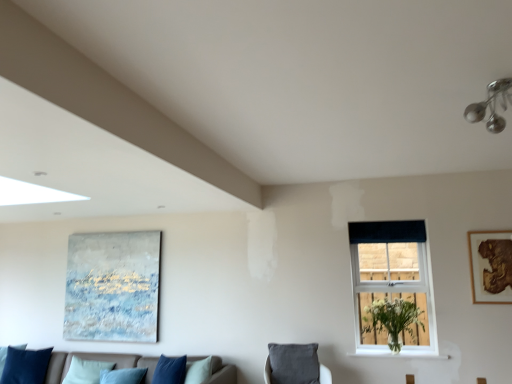
Question: Is wooden framed artwork at upper right, which appears as the first picture frame when viewed from the right, wider or thinner than dark blue fabric at upper right?

Choices:
 (A) wide
 (B) thin

Answer: (B)

Question: Is point (505, 244) positioned closer to the camera than point (364, 241)?

Choices:
 (A) farther
 (B) closer

Answer: (B)

Question: Which of these objects is positioned farthest from the dark blue fabric at upper right?

Choices:
 (A) velvet grey cushion at lower center
 (B) white painted wood at lower right
 (C) wooden framed artwork at upper right, which appears as the first picture frame when viewed from the right
 (D) velvet blue cushions at lower left
 (E) white plastic window at center

Answer: (D)

Question: Which object is positioned farthest from the wooden framed artwork at upper right, the 1th picture frame when ordered from front to back?

Choices:
 (A) white matte vase at window
 (B) velvet blue pillow at lower left
 (C) velvet blue cushions at lower left
 (D) white plastic window at center
 (E) dark blue fabric at upper right

Answer: (B)